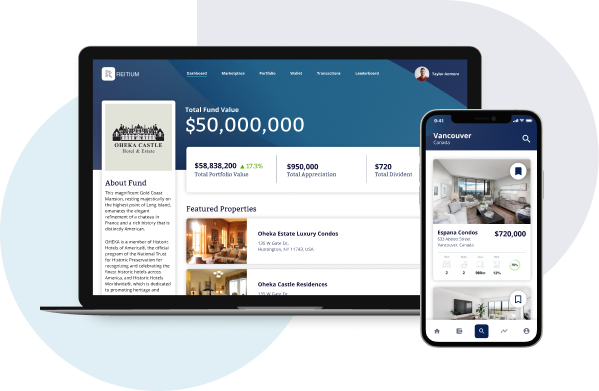
The image size is (599, 391). I want to click on laptop screen, so click(x=346, y=173).